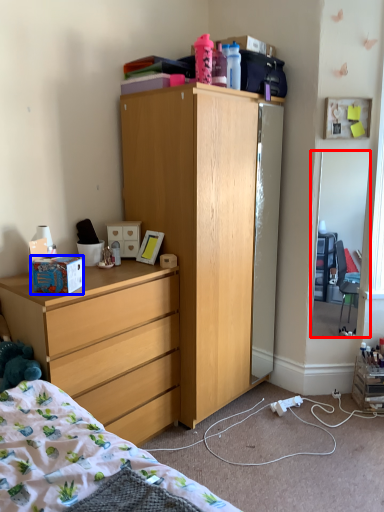
Question: Which of the following is the farthest to the observer, mirror (highlighted by a red box) or box (highlighted by a blue box)?

Choices:
 (A) mirror
 (B) box

Answer: (A)